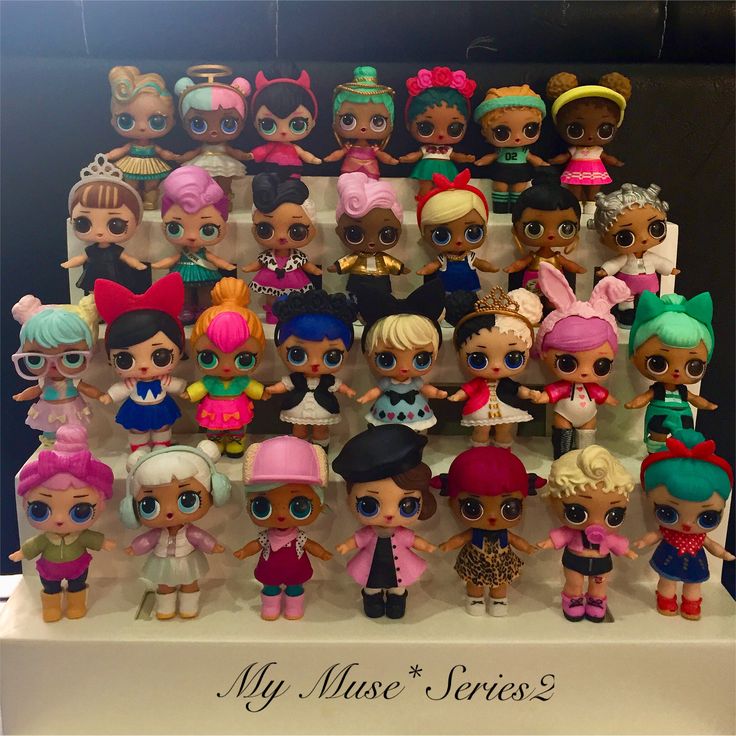
Image resolution: width=736 pixels, height=736 pixels. I want to click on dolls with blonde hair, so click(63, 325), click(162, 466), click(592, 477), click(509, 347), click(411, 338), click(439, 238), click(145, 105), click(520, 112).